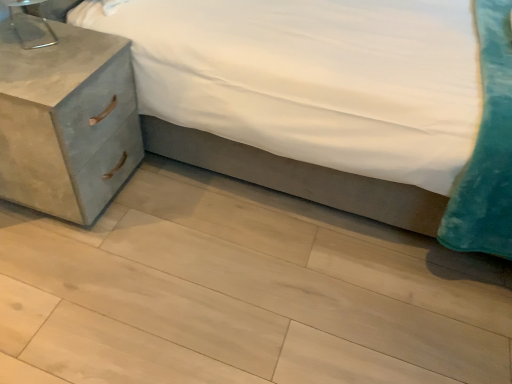
Question: Can you confirm if metallic silver table lamp at upper left is positioned to the right of light wood floor at lower center?

Choices:
 (A) yes
 (B) no

Answer: (B)

Question: Does metallic silver table lamp at upper left have a greater width compared to light wood floor at lower center?

Choices:
 (A) yes
 (B) no

Answer: (B)

Question: Is metallic silver table lamp at upper left not close to light wood floor at lower center?

Choices:
 (A) yes
 (B) no

Answer: (A)

Question: Considering the relative sizes of metallic silver table lamp at upper left and light wood floor at lower center in the image provided, is metallic silver table lamp at upper left shorter than light wood floor at lower center?

Choices:
 (A) no
 (B) yes

Answer: (A)

Question: Does metallic silver table lamp at upper left have a lesser width compared to light wood floor at lower center?

Choices:
 (A) no
 (B) yes

Answer: (B)

Question: Is matte concrete nightstand at left wider or thinner than light wood floor at lower center?

Choices:
 (A) wide
 (B) thin

Answer: (B)

Question: From their relative heights in the image, would you say matte concrete nightstand at left is taller or shorter than light wood floor at lower center?

Choices:
 (A) tall
 (B) short

Answer: (A)

Question: From a real-world perspective, is matte concrete nightstand at left positioned above or below light wood floor at lower center?

Choices:
 (A) above
 (B) below

Answer: (A)

Question: Looking at the image, does matte concrete nightstand at left seem bigger or smaller compared to light wood floor at lower center?

Choices:
 (A) small
 (B) big

Answer: (A)

Question: From their relative heights in the image, would you say metallic silver table lamp at upper left is taller or shorter than velvet teal pillow at lower right?

Choices:
 (A) tall
 (B) short

Answer: (B)

Question: Would you say metallic silver table lamp at upper left is to the left or to the right of velvet teal pillow at lower right in the picture?

Choices:
 (A) left
 (B) right

Answer: (A)

Question: From a real-world perspective, is metallic silver table lamp at upper left above or below velvet teal pillow at lower right?

Choices:
 (A) above
 (B) below

Answer: (A)

Question: Would you say metallic silver table lamp at upper left is inside or outside velvet teal pillow at lower right?

Choices:
 (A) outside
 (B) inside

Answer: (B)

Question: In the image, is velvet teal pillow at lower right on the left side or the right side of matte concrete nightstand at left?

Choices:
 (A) right
 (B) left

Answer: (A)

Question: Looking at their shapes, would you say velvet teal pillow at lower right is wider or thinner than matte concrete nightstand at left?

Choices:
 (A) wide
 (B) thin

Answer: (A)